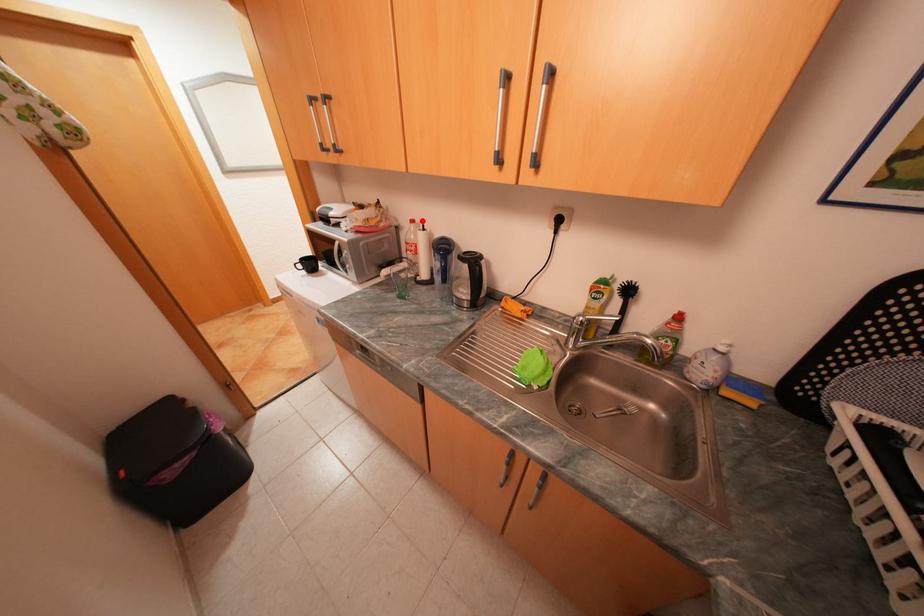
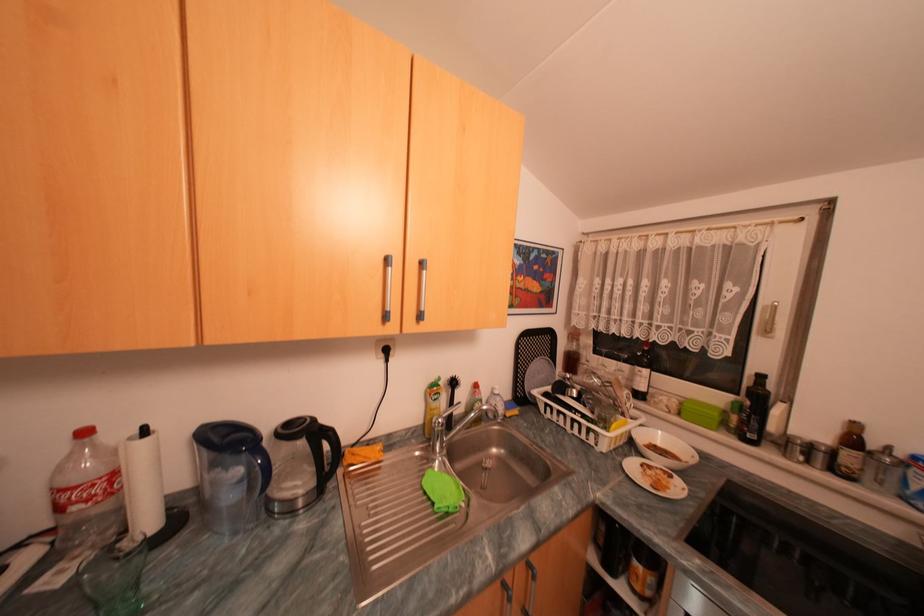
In the second image, find the point that corresponds to the highlighted location in the first image.

(94, 432)